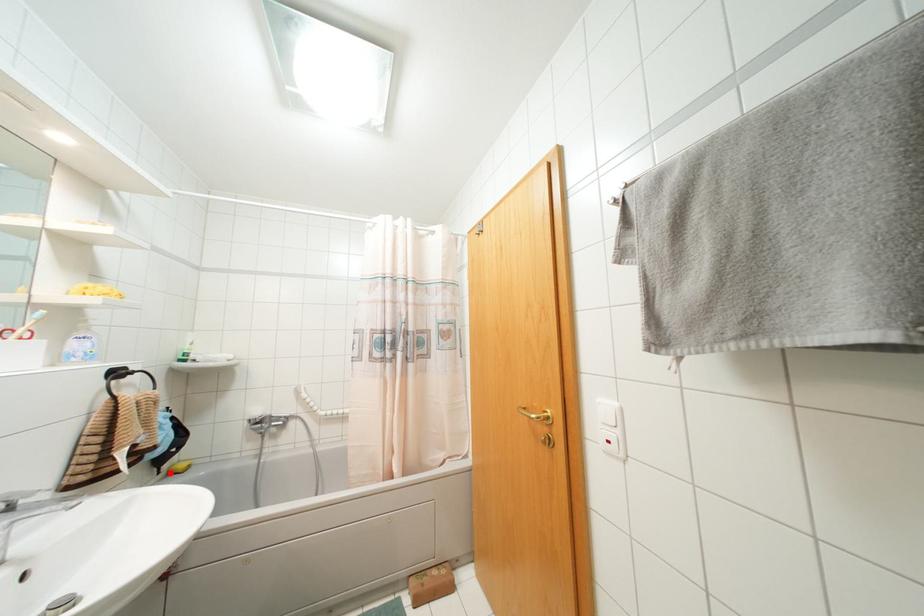
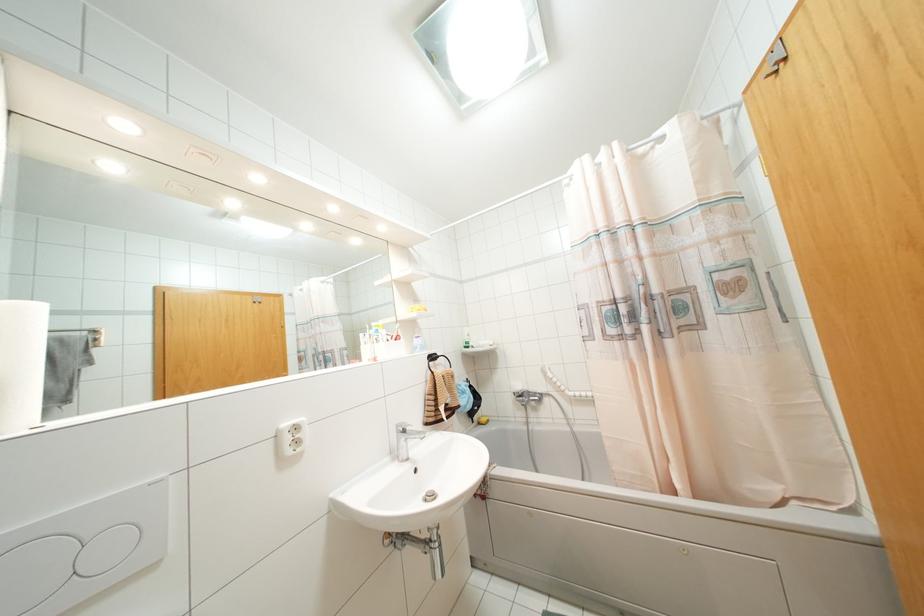
Question: I am providing you with two images of the same scene from different viewpoints. A red point is shown in image1. For the corresponding object point in image2, is it positioned nearer or farther from the camera?

Choices:
 (A) Nearer
 (B) Farther

Answer: (B)